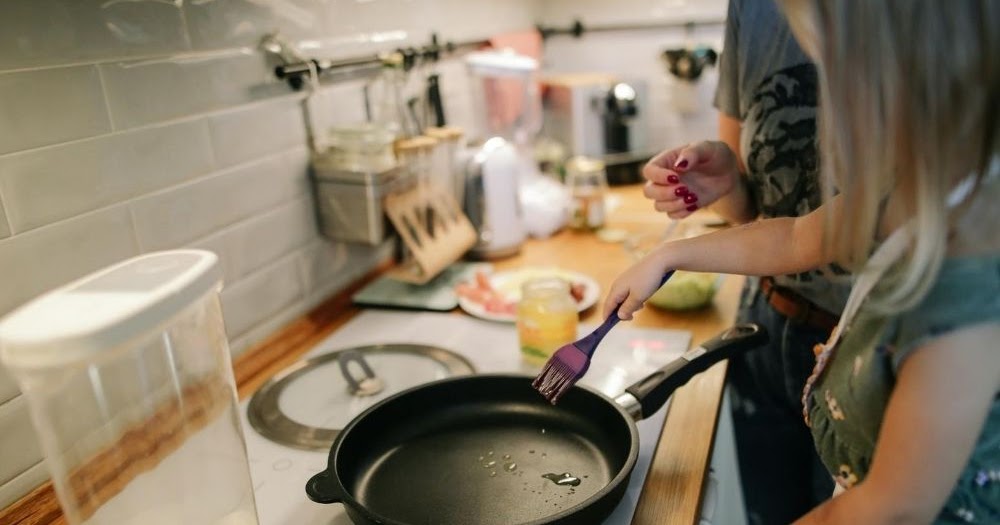
Identify the location of wall. The image size is (1000, 525). (158, 160).